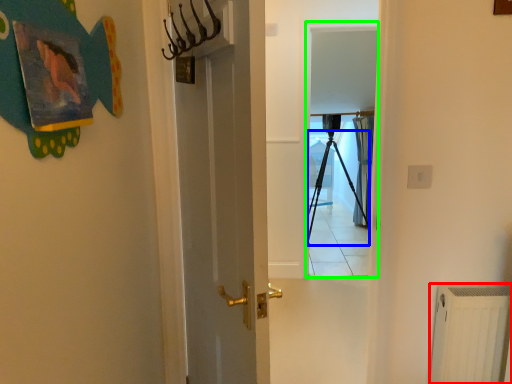
Question: Which object is positioned farthest from radiator (highlighted by a red box)? Select from tripod (highlighted by a blue box) and screen door (highlighted by a green box).

Choices:
 (A) tripod
 (B) screen door

Answer: (A)